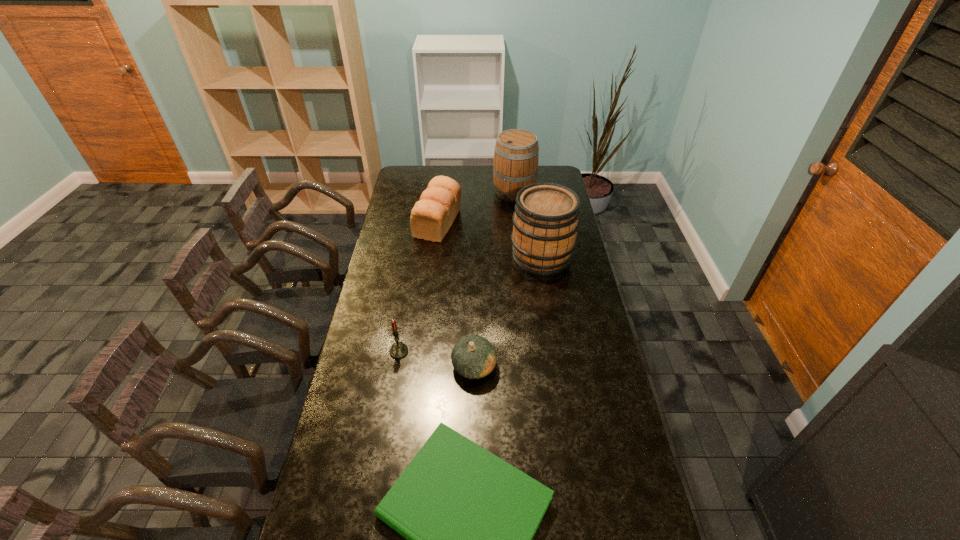
This screenshot has width=960, height=540. What are the coordinates of `the farthest object` in the screenshot? It's located at (516, 155).

I want to click on the nearer cider, so click(546, 219).

At what (x,y) coordinates should I click in order to perform the action: click on bread. Please return your answer as a coordinate pair (x, y). This screenshot has height=540, width=960. Looking at the image, I should click on (432, 216).

This screenshot has height=540, width=960. Find the location of `candle`. candle is located at coordinates (398, 350).

At what (x,y) coordinates should I click in order to perform the action: click on gourd. Please return your answer as a coordinate pair (x, y). This screenshot has height=540, width=960. Looking at the image, I should click on (473, 357).

The image size is (960, 540). What are the coordinates of `vacant region located on the left of the farthest object` in the screenshot? It's located at (454, 192).

Find the location of `vacant point located on the left of the nearer cider`. vacant point located on the left of the nearer cider is located at coordinates (486, 256).

Locate an element on the screen. This screenshot has width=960, height=540. free point located on the back of the bread is located at coordinates (444, 175).

Find the location of a particular element. This screenshot has width=960, height=540. vacant space located on the front of the candle is located at coordinates (390, 407).

You are a GUI agent. You are given a task and a screenshot of the screen. Output one action in this format:
    pyautogui.click(x=<x>, y=<y>)
    Task: Click on the vacant space situated on the left of the second shortest object
    This screenshot has height=540, width=960.
    Given the screenshot: What is the action you would take?
    pyautogui.click(x=381, y=366)